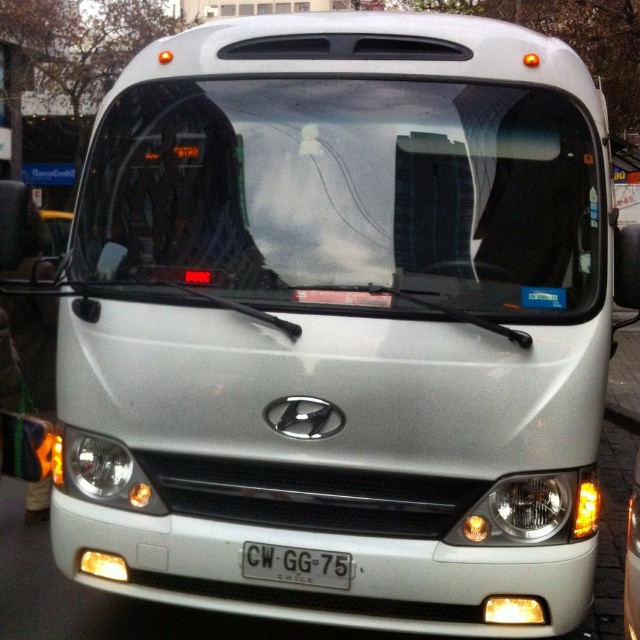
Is clear glass windshield at center above matte white headlight at center?

Indeed, clear glass windshield at center is positioned over matte white headlight at center.

Who is lower down, clear glass windshield at center or matte white headlight at center?

matte white headlight at center is lower down.

Where is `clear glass windshield at center`? This screenshot has height=640, width=640. clear glass windshield at center is located at coordinates (346, 196).

Is clear glass windshield at center taller than white plastic license plate at center?

Correct, clear glass windshield at center is much taller as white plastic license plate at center.

In the scene shown: Who is more distant from viewer, (524, 100) or (292, 566)?

The point (524, 100) is more distant.

Which is behind, point (474, 198) or point (268, 579)?

The point (474, 198) is more distant.

Identify the location of clear glass windshield at center. The height and width of the screenshot is (640, 640). (346, 196).

Who is more forward, [276,573] or [92,433]?

Positioned in front is point [276,573].

Does white plastic license plate at center have a greater height compared to matte white headlight at center?

No.

Does point (285, 570) come behind point (113, 497)?

No, (285, 570) is closer to viewer.

Locate an element on the screen. Image resolution: width=640 pixels, height=640 pixels. white plastic license plate at center is located at coordinates (296, 564).